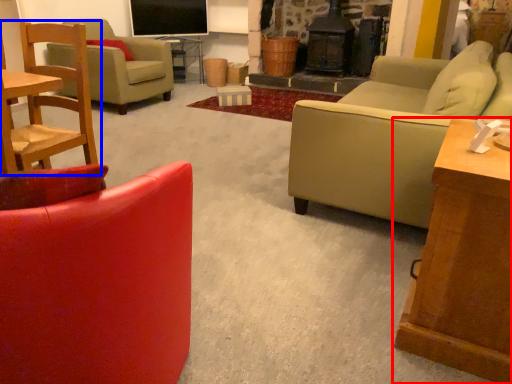
Question: Which point is closer to the camera, table (highlighted by a red box) or chair (highlighted by a blue box)?

Choices:
 (A) table
 (B) chair

Answer: (A)